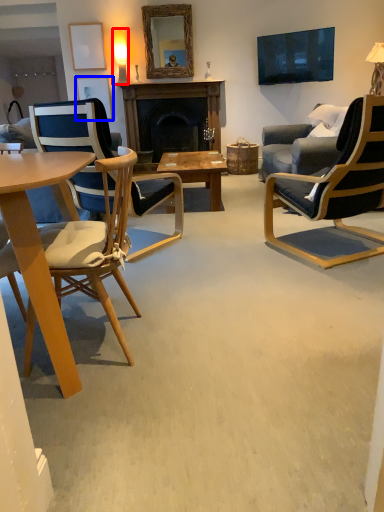
Question: Among these objects, which one is farthest to the camera, lamp (highlighted by a red box) or picture frame (highlighted by a blue box)?

Choices:
 (A) lamp
 (B) picture frame

Answer: (B)